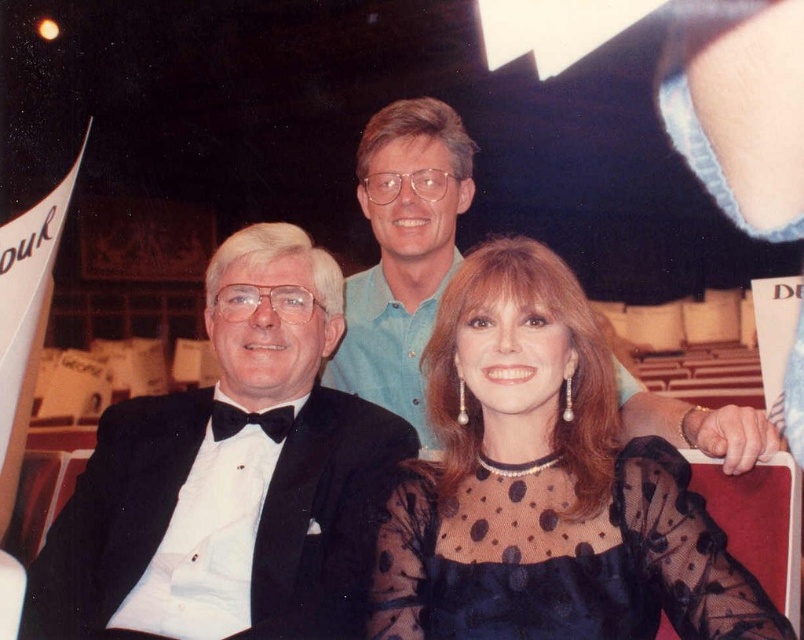
Question: Among these points, which one is farthest from the camera?

Choices:
 (A) (620, 557)
 (B) (400, 157)
 (C) (134, 544)

Answer: (B)

Question: Which object is farther from the camera taking this photo?

Choices:
 (A) black sheer polka dot cocktail dress at center
 (B) light blue shirt at upper center

Answer: (B)

Question: Is black sheer dress at center above light blue shirt at upper center?

Choices:
 (A) yes
 (B) no

Answer: (B)

Question: Can you confirm if black satin tuxedo at left is positioned to the right of light blue shirt at upper center?

Choices:
 (A) no
 (B) yes

Answer: (A)

Question: Which object appears farthest from the camera in this image?

Choices:
 (A) black sheer polka dot cocktail dress at center
 (B) black satin tuxedo at left

Answer: (B)

Question: Where is black satin tuxedo at left located in relation to light blue shirt at upper center in the image?

Choices:
 (A) left
 (B) right

Answer: (A)